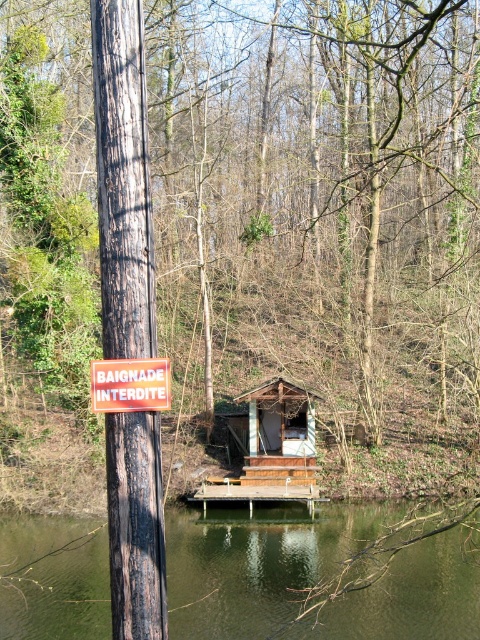
Consider the image. Is greenish-brown water at lower center taller than dark brown wood telegraph pole at left?

In fact, greenish-brown water at lower center may be shorter than dark brown wood telegraph pole at left.

In the scene shown: Who is more distant from viewer, (380, 528) or (145, 257)?

Positioned behind is point (380, 528).

Identify the location of greenish-brown water at lower center. Image resolution: width=480 pixels, height=640 pixels. (255, 563).

Between point (223, 516) and point (167, 403), which one is positioned in front?

Point (167, 403) is more forward.

Does greenish-brown water at lower center appear on the left side of orange plastic sign at upper center?

Correct, you'll find greenish-brown water at lower center to the left of orange plastic sign at upper center.

Between point (189, 577) and point (137, 410), which one is positioned behind?

Positioned behind is point (189, 577).

I want to click on greenish-brown water at lower center, so click(x=255, y=563).

Who is more forward, [137,184] or [116,362]?

Point [137,184]

Image resolution: width=480 pixels, height=640 pixels. What are the coordinates of `dark brown wood telegraph pole at left` in the screenshot? It's located at (122, 179).

Where is `dark brown wood telegraph pole at left`? This screenshot has height=640, width=480. dark brown wood telegraph pole at left is located at coordinates (122, 179).